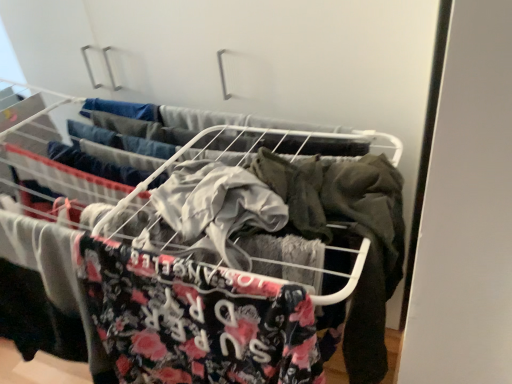
Where is `metal wire rack at center`? The height and width of the screenshot is (384, 512). metal wire rack at center is located at coordinates (359, 246).

This screenshot has height=384, width=512. What do you see at coordinates (359, 246) in the screenshot? I see `metal wire rack at center` at bounding box center [359, 246].

Describe the element at coordinates (94, 164) in the screenshot. I see `gray fabric shirt at center` at that location.

Identify the location of gray fabric shirt at center. The height and width of the screenshot is (384, 512). (94, 164).

Where is `metal wire rack at center`? The image size is (512, 384). metal wire rack at center is located at coordinates (359, 246).

Which is more to the right, metal wire rack at center or gray fabric shirt at center?

metal wire rack at center.

Is metal wire rack at center in front of gray fabric shirt at center?

Yes, it is.

Considering the points (181, 243) and (113, 180), which point is in front, point (181, 243) or point (113, 180)?

The point (181, 243) is closer.

From the image's perspective, which one is positioned higher, metal wire rack at center or gray fabric shirt at center?

gray fabric shirt at center appears higher in the image.

From a real-world perspective, is metal wire rack at center positioned above or below gray fabric shirt at center?

metal wire rack at center is situated higher than gray fabric shirt at center in the real world.

Between metal wire rack at center and gray fabric shirt at center, which one has larger width?

Wider between the two is metal wire rack at center.

Which of these two, metal wire rack at center or gray fabric shirt at center, stands taller?

metal wire rack at center.

Considering the relative sizes of metal wire rack at center and gray fabric shirt at center in the image provided, is metal wire rack at center bigger than gray fabric shirt at center?

Yes, metal wire rack at center is bigger than gray fabric shirt at center.

Is metal wire rack at center not inside gray fabric shirt at center?

Indeed, metal wire rack at center is completely outside gray fabric shirt at center.

Is metal wire rack at center placed right next to gray fabric shirt at center?

metal wire rack at center and gray fabric shirt at center are not in contact.

Is metal wire rack at center positioned with its back to gray fabric shirt at center?

No, metal wire rack at center is not facing away from gray fabric shirt at center.

You are a GUI agent. You are given a task and a screenshot of the screen. Output one action in this format:
    pyautogui.click(x=<x>, y=<y>)
    Task: Click on the clothing on the left side of metal wire rack at center
    
    Given the screenshot: What is the action you would take?
    pyautogui.click(x=94, y=164)

Visually, is gray fabric shirt at center positioned to the left or to the right of metal wire rack at center?

gray fabric shirt at center is positioned on metal wire rack at center's left side.

In the image, is gray fabric shirt at center positioned in front of or behind metal wire rack at center?

Visually, gray fabric shirt at center is located behind metal wire rack at center.

Between point (65, 150) and point (302, 351), which one is positioned in front?

The point (302, 351) is closer.

From the image's perspective, which is below, gray fabric shirt at center or metal wire rack at center?

metal wire rack at center.

From a real-world perspective, is gray fabric shirt at center located higher than metal wire rack at center?

Actually, gray fabric shirt at center is physically below metal wire rack at center in the real world.

Between gray fabric shirt at center and metal wire rack at center, which one has larger width?

metal wire rack at center is wider.

Is gray fabric shirt at center taller or shorter than metal wire rack at center?

In the image, gray fabric shirt at center appears to be shorter than metal wire rack at center.

Considering the sizes of objects gray fabric shirt at center and metal wire rack at center in the image provided, who is bigger, gray fabric shirt at center or metal wire rack at center?

metal wire rack at center.

In the scene shown: Is metal wire rack at center a part of gray fabric shirt at center?

No, metal wire rack at center is located outside of gray fabric shirt at center.

Is gray fabric shirt at center not close to metal wire rack at center?

Actually, gray fabric shirt at center and metal wire rack at center are a little close together.

Could you tell me if gray fabric shirt at center is turned towards metal wire rack at center?

No, gray fabric shirt at center is not aimed at metal wire rack at center.

How distant is gray fabric shirt at center from metal wire rack at center?

The distance of gray fabric shirt at center from metal wire rack at center is 11.16 inches.

The height and width of the screenshot is (384, 512). I want to click on furniture in front of the gray fabric shirt at center, so click(359, 246).

Image resolution: width=512 pixels, height=384 pixels. Find the location of `clothing above the metal wire rack at center (from the image's perspective)`. clothing above the metal wire rack at center (from the image's perspective) is located at coordinates (94, 164).

Locate an element on the screen. The image size is (512, 384). clothing on the left of metal wire rack at center is located at coordinates (94, 164).